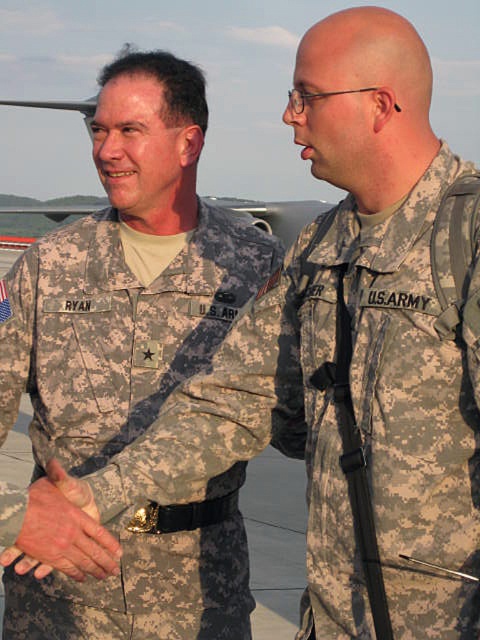
Question: Does camouflage fabric uniform at center appear on the right side of leather glove at center?

Choices:
 (A) no
 (B) yes

Answer: (A)

Question: Does camouflage fabric uniform at center appear on the left side of leather glove at center?

Choices:
 (A) yes
 (B) no

Answer: (A)

Question: Which point is farther from the camera taking this photo?

Choices:
 (A) (66, 573)
 (B) (37, 253)
 (C) (403, 628)

Answer: (B)

Question: Among these points, which one is nearest to the camera?

Choices:
 (A) (126, 605)
 (B) (93, 538)
 (C) (430, 464)

Answer: (B)

Question: Is camouflage fabric us army uniform at right further to the viewer compared to camouflage fabric uniform at center?

Choices:
 (A) no
 (B) yes

Answer: (A)

Question: Which of the following is the farthest from the observer?

Choices:
 (A) (80, 545)
 (B) (300, 339)
 (C) (59, 376)

Answer: (C)